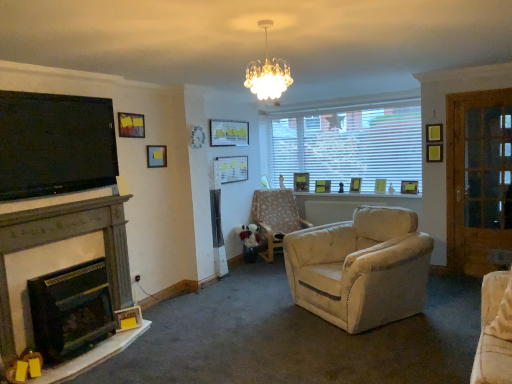
Question: Considering the relative positions of floral fabric chair at center and crystalline glass chandelier at upper center in the image provided, is floral fabric chair at center to the left or to the right of crystalline glass chandelier at upper center?

Choices:
 (A) left
 (B) right

Answer: (B)

Question: Do you think floral fabric chair at center is within crystalline glass chandelier at upper center, or outside of it?

Choices:
 (A) outside
 (B) inside

Answer: (A)

Question: Based on their relative distances, which object is nearer to the dark gray stone fireplace at left, the second fireplace from the bottom?

Choices:
 (A) crystalline glass chandelier at upper center
 (B) matte yellow picture frame at upper right, arranged as the 7th picture frame when viewed from the left
 (C) wooden picture frame at right, the 9th picture frame viewed from the left
 (D) matte wooden picture frame at center, the 5th picture frame in the right-to-left sequence
 (E) matte glass picture frame at upper center, acting as the third picture frame starting from the left

Answer: (A)

Question: Based on their relative distances, which object is nearer to the white blinds at upper center?

Choices:
 (A) floral fabric chair at center
 (B) dark gray stone fireplace at left, the 1th fireplace when ordered from top to bottom
 (C) matte yellow picture frame at window, which is counted as the 6th picture frame, starting from the left
 (D) wooden glass door at right
 (E) matte wooden picture frame at center, arranged as the ninth picture frame when viewed from the front

Answer: (C)